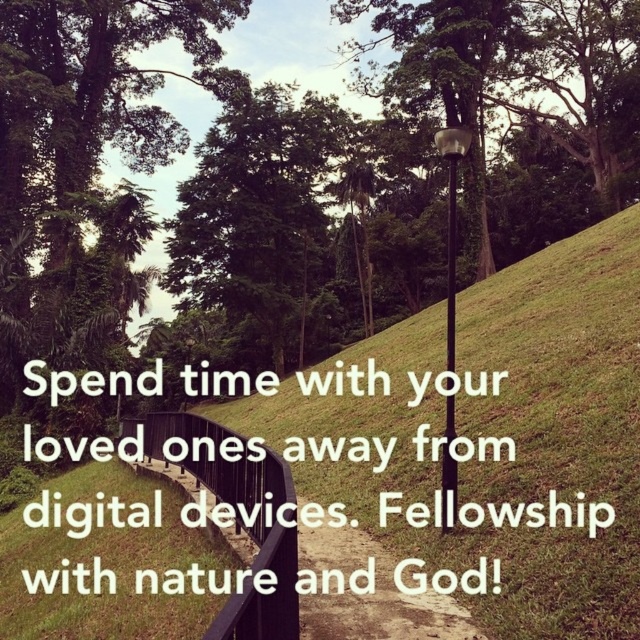
Is point (332, 560) closer to viewer compared to point (445, 492)?

Yes, point (332, 560) is in front of point (445, 492).

Does black metal path at center have a larger size compared to metallic pole at center?

Incorrect, black metal path at center is not larger than metallic pole at center.

Is point (173, 483) less distant than point (444, 456)?

No.

The width and height of the screenshot is (640, 640). Identify the location of black metal path at center. (372, 596).

Identify the location of black metal path at center. (372, 596).

Is point (340, 545) more distant than point (445, 502)?

Yes, point (340, 545) is behind point (445, 502).

The height and width of the screenshot is (640, 640). In order to click on black metal path at center in this screenshot , I will do `click(372, 596)`.

Is black metal lamp post at center wider than metallic pole at center?

Indeed, black metal lamp post at center has a greater width compared to metallic pole at center.

Does point (449, 508) lie behind point (444, 490)?

No, it is in front of (444, 490).

Locate an element on the screen. The height and width of the screenshot is (640, 640). black metal lamp post at center is located at coordinates (451, 220).

Where is `black metal lamp post at center`? The width and height of the screenshot is (640, 640). black metal lamp post at center is located at coordinates (451, 220).